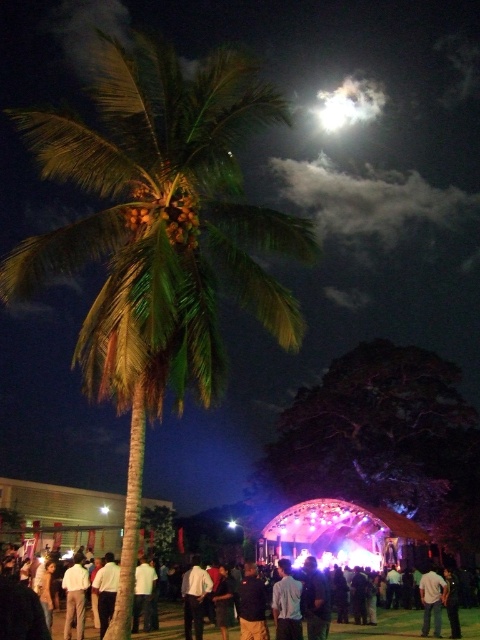
You are at a festival and want to find the person wearing the light brown fabric shirt at lower left. Which direction should you look from the white matte shirt at center?

The light brown fabric shirt at lower left is to the left of the white matte shirt at center, so you should look to the left from the white matte shirt at center to find it.

You are at a festival and want to take a photo of the stage. The camera you are using has a maximum focus range of 80 meters. Is the point at coordinates point [386,624] within the camera focus range?

The point at coordinates point [386,624] is 83.78 meters away from the camera, which exceeds the camera maximum focus range of 80 meters. Therefore, the camera cannot focus on that point.

You are standing at the festival and notice two points in the image. One is at coordinates point (172, 637) and the other is at point (288, 600). Which point is closer to you?

Point (172, 637) is further to the camera than point (288, 600), so the point closer to you is point (288, 600).